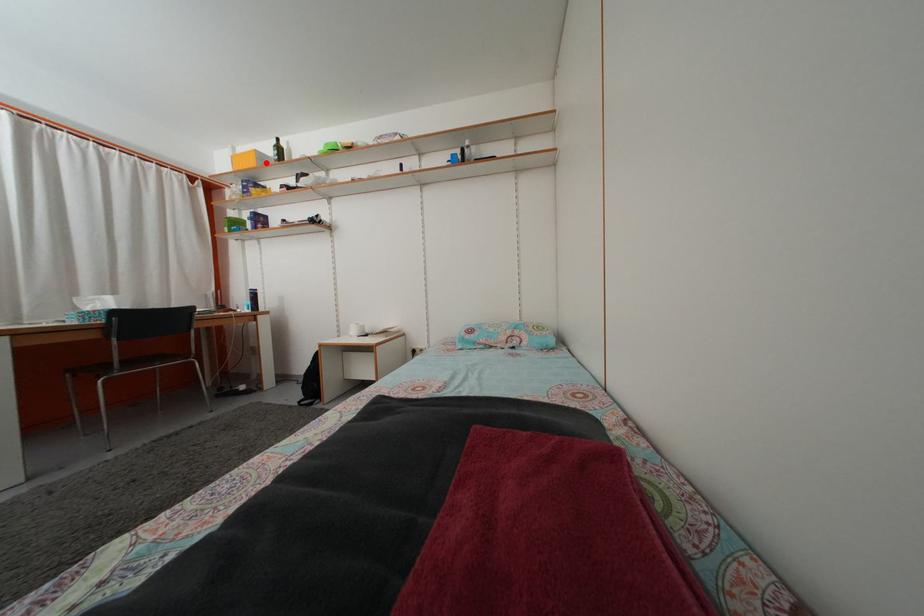
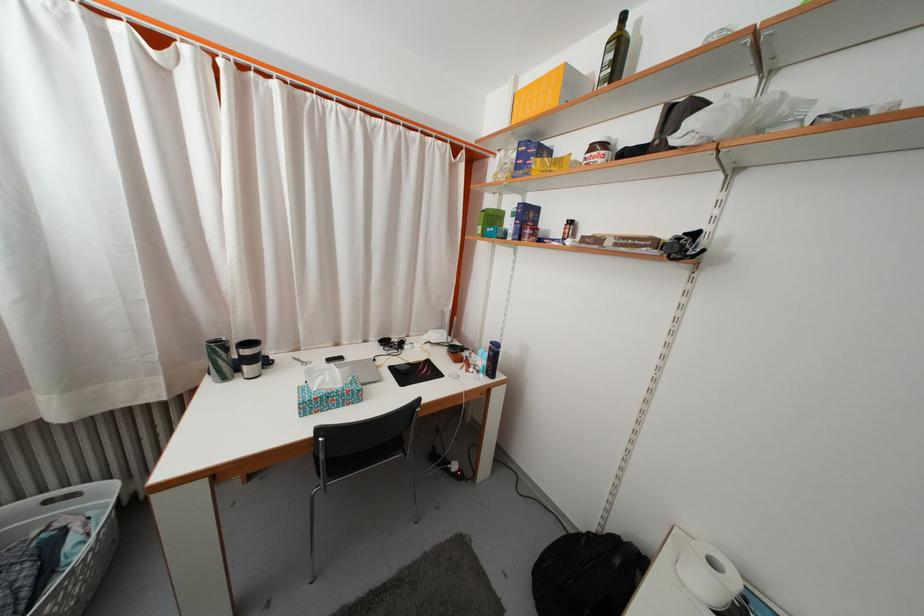
Where in the second image is the point corresponding to the highlighted location from the first image?

(575, 84)